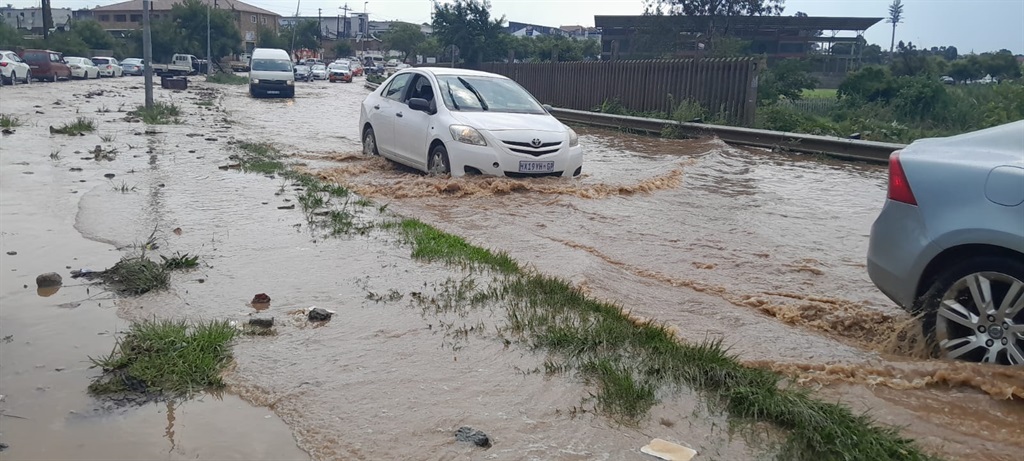
Identify the location of light. The image size is (1024, 461). (463, 139).